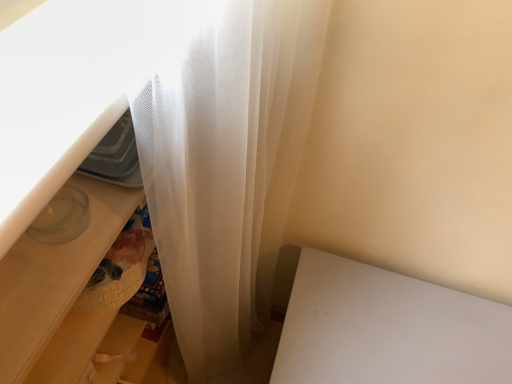
Where is `free space above translucent plastic drawer at lower left (from a real-world perspective)`? The height and width of the screenshot is (384, 512). free space above translucent plastic drawer at lower left (from a real-world perspective) is located at coordinates (75, 210).